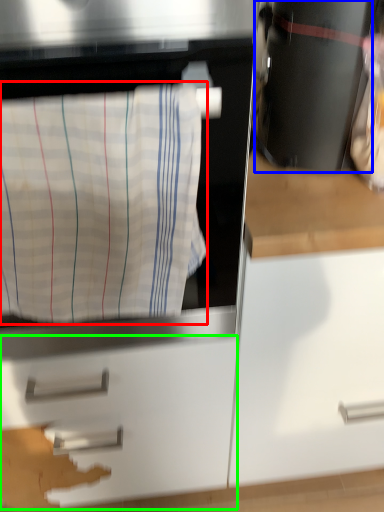
Question: Which object is the closest to the laundry (highlighted by a red box)? Choose among these: appliance (highlighted by a blue box) or drawer (highlighted by a green box).

Choices:
 (A) appliance
 (B) drawer

Answer: (A)